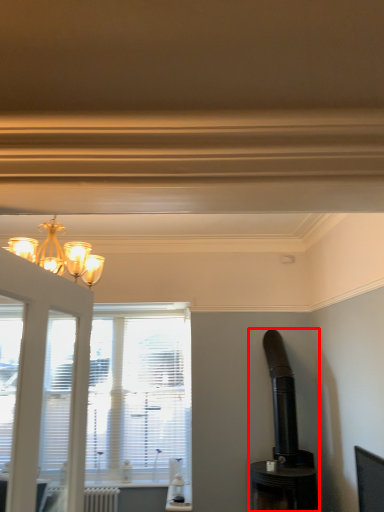
Question: Observing the image, what is the correct spatial positioning of appliance (annotated by the red box) in reference to radiator?

Choices:
 (A) right
 (B) left

Answer: (A)